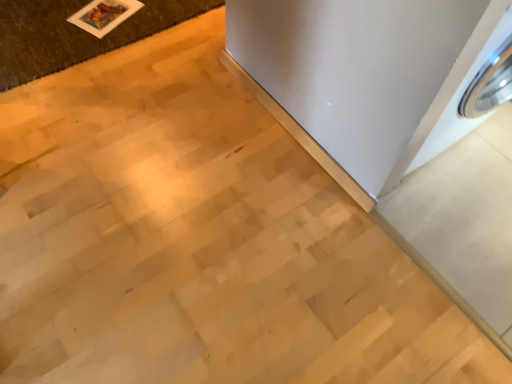
Describe the element at coordinates (104, 15) in the screenshot. I see `white matte picture frame at upper left` at that location.

In order to face white matte picture frame at upper left, should I rotate leftwards or rightwards?

You should look left and rotate roughly 19.264 degrees.

The width and height of the screenshot is (512, 384). What are the coordinates of `white matte picture frame at upper left` in the screenshot? It's located at (104, 15).

The width and height of the screenshot is (512, 384). Find the location of `white matte picture frame at upper left`. white matte picture frame at upper left is located at coordinates (104, 15).